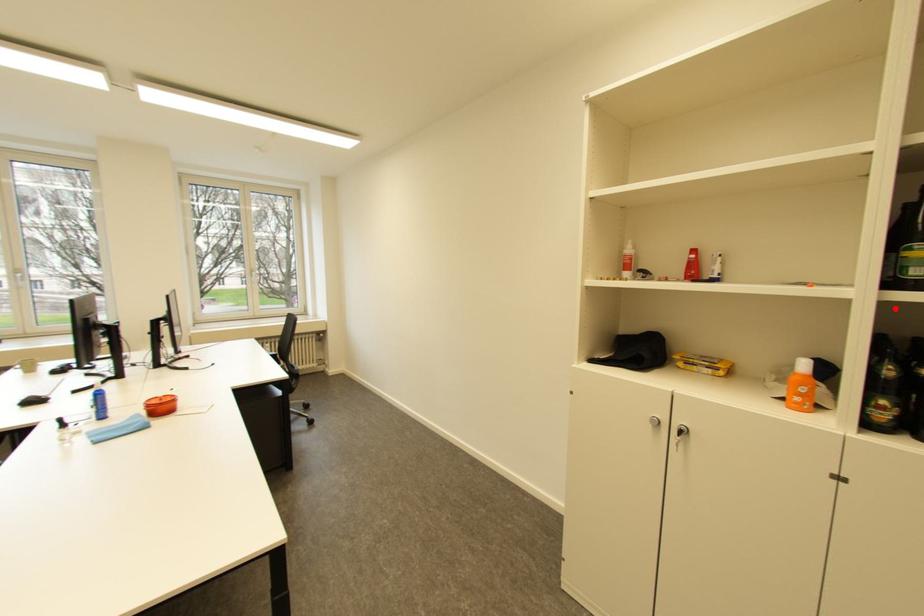
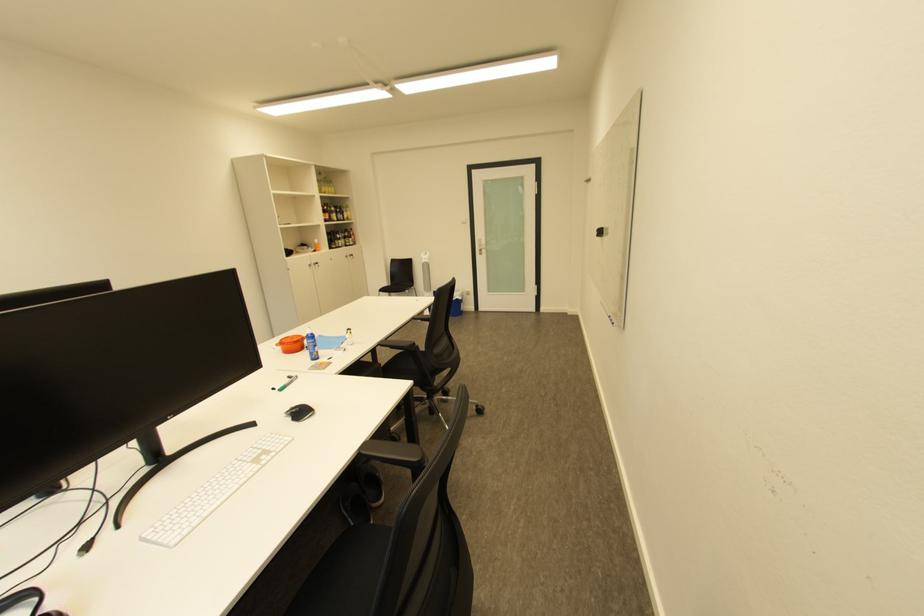
The point at the highlighted location is marked in the first image. Where is the corresponding point in the second image?

(335, 225)